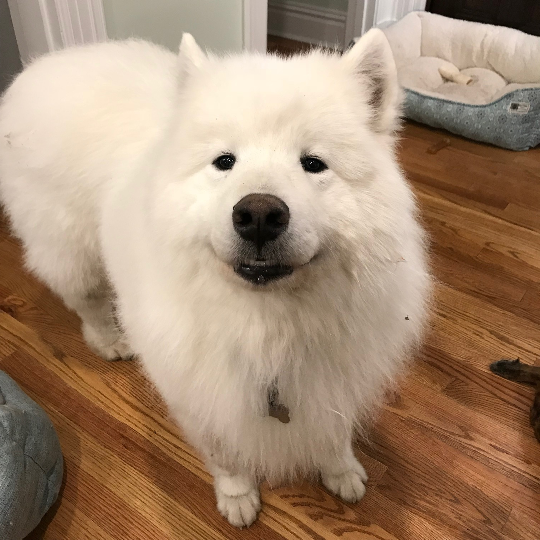
This screenshot has height=540, width=540. Find the location of `dog bed`. dog bed is located at coordinates (448, 94).